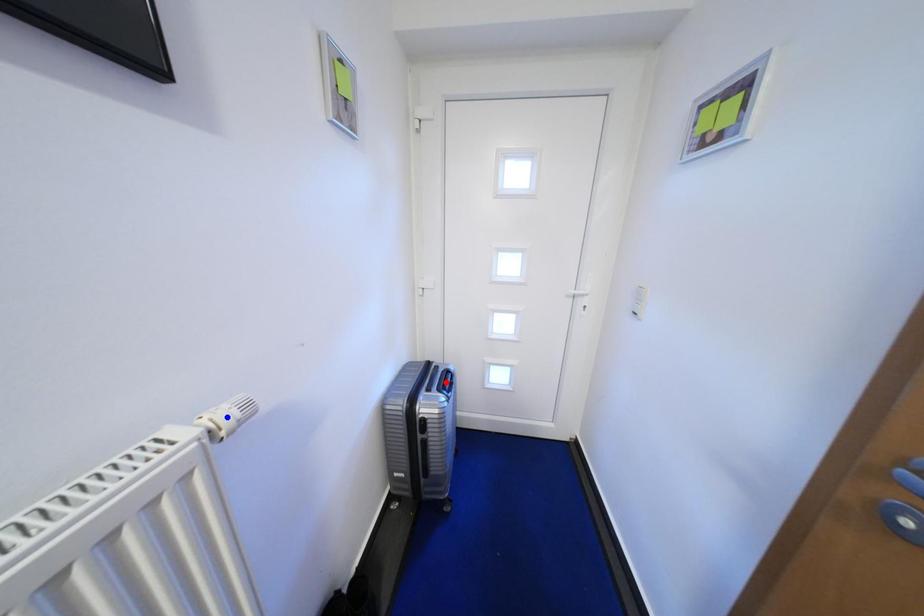
Question: In the image, two points are highlighted. Which point is nearer to the camera? Reply with the corresponding letter.

Choices:
 (A) blue point
 (B) red point

Answer: (A)